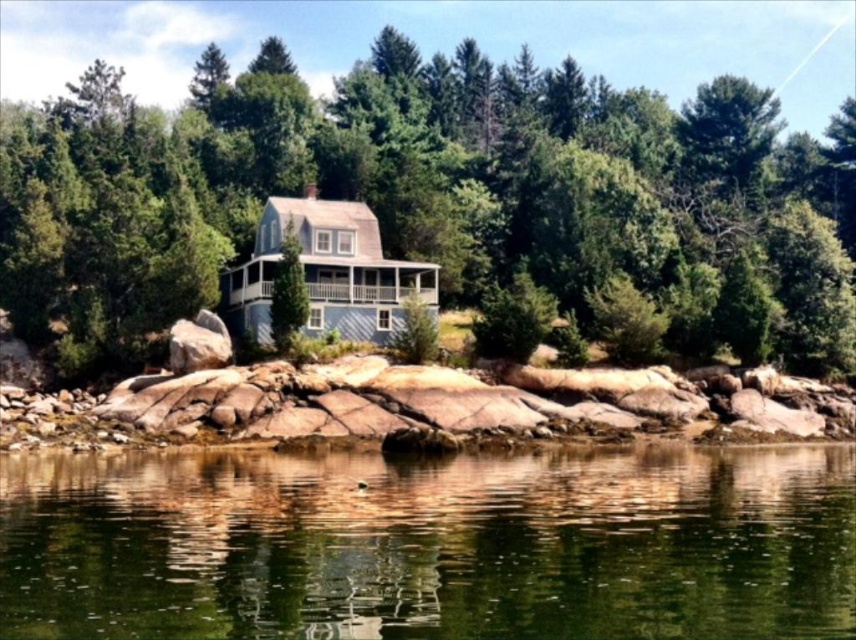
Question: Where is green textured tree at center located in relation to brown rock at center in the image?

Choices:
 (A) left
 (B) right

Answer: (A)

Question: Which point appears farthest from the camera in this image?

Choices:
 (A) (813, 394)
 (B) (815, 300)

Answer: (B)

Question: Which of the following is the farthest from the observer?

Choices:
 (A) brown rock at center
 (B) green reflective water at center

Answer: (A)

Question: Can you confirm if green reflective water at center is thinner than brown rock at center?

Choices:
 (A) no
 (B) yes

Answer: (B)

Question: Which of the following is the farthest from the observer?

Choices:
 (A) (642, 230)
 (B) (480, 477)
 (C) (700, 401)

Answer: (A)

Question: Does green reflective water at center appear on the left side of brown rock at center?

Choices:
 (A) yes
 (B) no

Answer: (B)